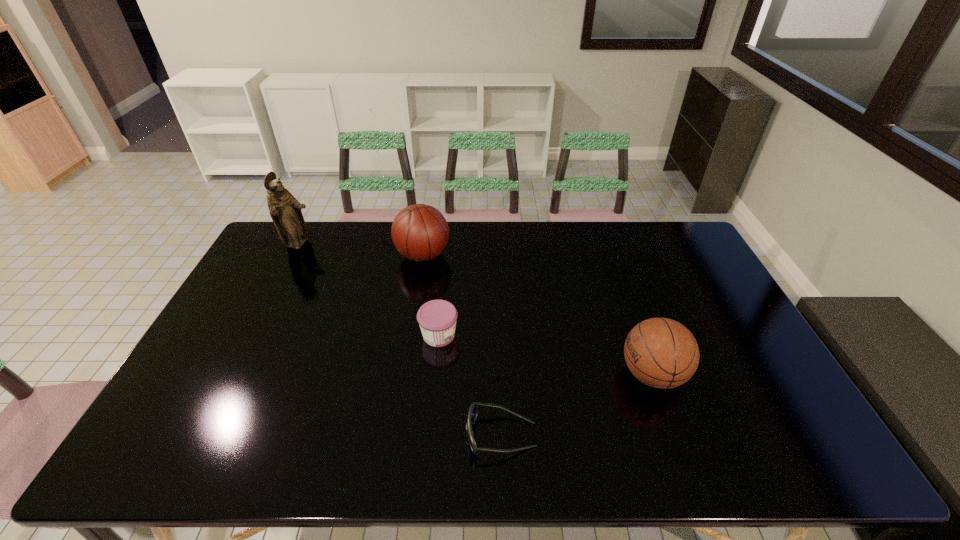
The image size is (960, 540). What are the coordinates of `blank area in the image that satisfies the following two spatial constraints: 1. on the back side of the left basketball; 2. on the front-facing side of the tallest object` in the screenshot? It's located at (424, 245).

Image resolution: width=960 pixels, height=540 pixels. In order to click on vacant area that satisfies the following two spatial constraints: 1. on the front-facing side of the figurine; 2. on the back side of the left basketball in this screenshot , I will do `click(294, 255)`.

Find the location of `vacant area that satisfies the following two spatial constraints: 1. on the back side of the left basketball; 2. on the front-facing side of the tallest object`. vacant area that satisfies the following two spatial constraints: 1. on the back side of the left basketball; 2. on the front-facing side of the tallest object is located at coordinates (424, 245).